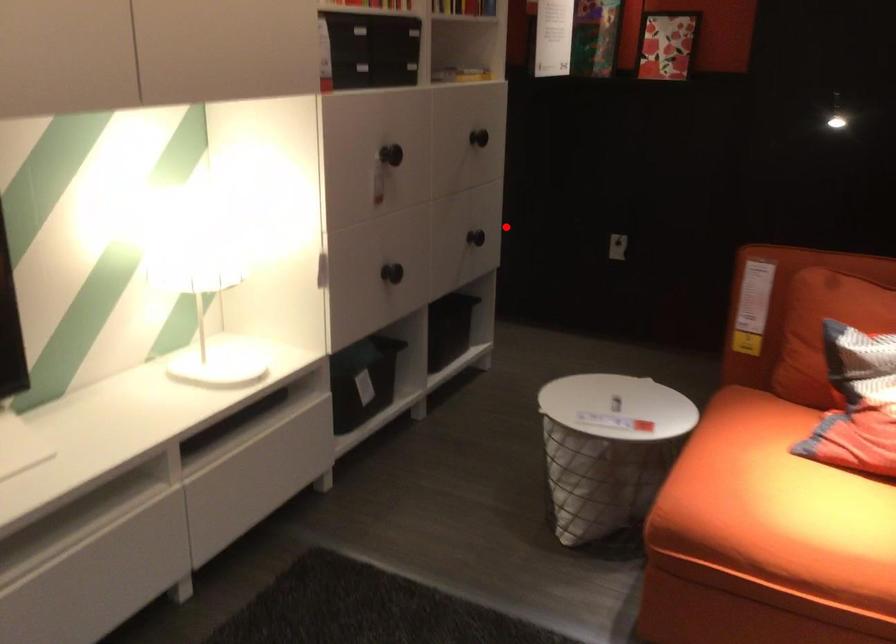
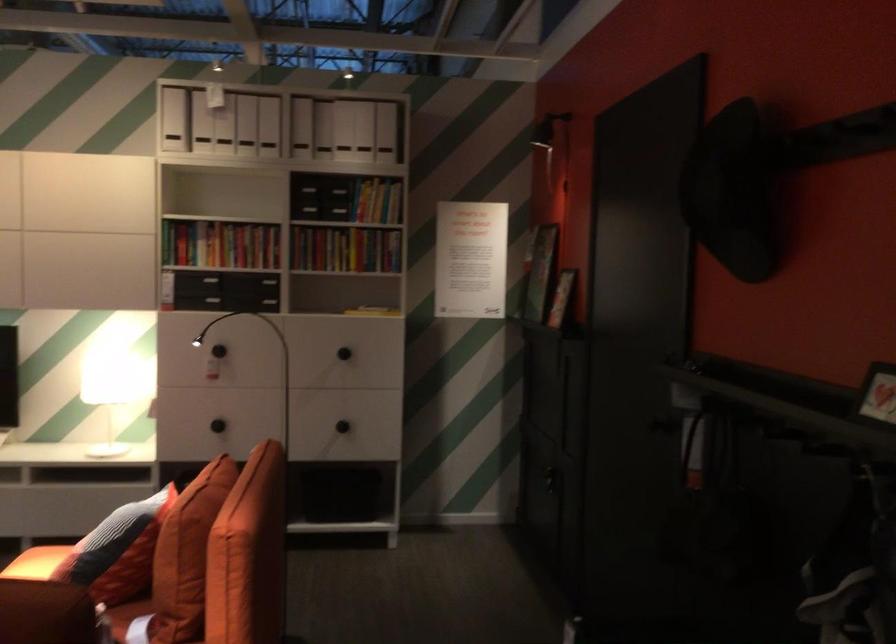
Question: I am providing you with two images of the same scene from different viewpoints. In image1, a red point is highlighted. Considering the same 3D point in image2, which of the following is correct?

Choices:
 (A) It is closer
 (B) It is farther

Answer: (B)